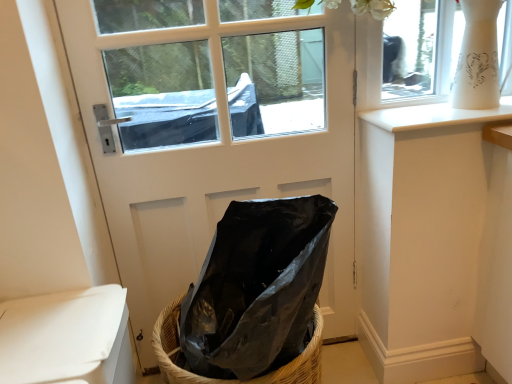
Locate an element on the screen. This screenshot has height=384, width=512. woven straw basket at lower center is located at coordinates (232, 379).

What is the approximate width of white matte toilet at lower left?

white matte toilet at lower left is 14.85 inches wide.

Locate an element on the screen. This screenshot has height=384, width=512. white matte door at center is located at coordinates (213, 131).

This screenshot has height=384, width=512. I want to click on black plastic bag at center, so click(x=256, y=288).

Identify the location of white glossy window sill at upper right. (434, 116).

Is black plastic bag at center completely or partially outside of white matte door at center?

Indeed, black plastic bag at center is completely outside white matte door at center.

Is black plastic bag at center wider than white matte door at center?

Indeed, black plastic bag at center has a greater width compared to white matte door at center.

Is black plastic bag at center not close to white matte door at center?

No, there isn't a large distance between black plastic bag at center and white matte door at center.

Considering the points (234, 256) and (341, 10), which point is in front, point (234, 256) or point (341, 10)?

Positioned in front is point (234, 256).

What's the angular difference between white matte toilet at lower left and white matte door at center's facing directions?

white matte toilet at lower left and white matte door at center are facing 90.5 degrees away from each other.

Between white matte toilet at lower left and white matte door at center, which one has smaller size?

white matte toilet at lower left is smaller.

Does white matte toilet at lower left touch white matte door at center?

There is a gap between white matte toilet at lower left and white matte door at center.

I want to click on door above the white matte toilet at lower left (from the image's perspective), so click(x=213, y=131).

Which object is further away from the camera taking this photo, white matte door at center or black plastic bag at center?

white matte door at center is behind.

Is white matte door at center not close to black plastic bag at center?

No, there isn't a large distance between white matte door at center and black plastic bag at center.

Which is more to the left, white matte door at center or black plastic bag at center?

white matte door at center.

How different are the orientations of white matte door at center and black plastic bag at center in degrees?

The angular difference between white matte door at center and black plastic bag at center is 0.452 degrees.

Considering the relative sizes of white glossy window sill at upper right and black plastic bag at center in the image provided, is white glossy window sill at upper right smaller than black plastic bag at center?

Indeed, white glossy window sill at upper right has a smaller size compared to black plastic bag at center.

Is white glossy window sill at upper right not close to black plastic bag at center?

white glossy window sill at upper right is actually quite close to black plastic bag at center.

The height and width of the screenshot is (384, 512). In order to click on bag below the white glossy window sill at upper right (from a real-world perspective) in this screenshot , I will do `click(256, 288)`.

Measure the distance from white glossy window sill at upper right to black plastic bag at center.

They are 21.90 inches apart.

How different are the orientations of white glossy window sill at upper right and woven straw basket at lower center in degrees?

They differ by 0.452 degrees in their facing directions.

Would you say woven straw basket at lower center is part of white glossy window sill at upper right's contents?

No, white glossy window sill at upper right does not contain woven straw basket at lower center.

From the image's perspective, which is below, white glossy window sill at upper right or woven straw basket at lower center?

woven straw basket at lower center appears lower in the image.

Where is `window sill above the woven straw basket at lower center (from the image's perspective)`? This screenshot has width=512, height=384. window sill above the woven straw basket at lower center (from the image's perspective) is located at coordinates (434, 116).

Looking at this image, is black plastic bag at center not inside woven straw basket at lower center?

Yes, black plastic bag at center is outside of woven straw basket at lower center.

In the scene shown: How many degrees apart are the facing directions of black plastic bag at center and woven straw basket at lower center?

4.77e-05 degrees.

Considering the relative sizes of black plastic bag at center and woven straw basket at lower center in the image provided, is black plastic bag at center thinner than woven straw basket at lower center?

Indeed, black plastic bag at center has a lesser width compared to woven straw basket at lower center.

Is black plastic bag at center aimed at woven straw basket at lower center?

No, black plastic bag at center is not turned towards woven straw basket at lower center.

Would you say white glossy window sill at upper right is outside white matte door at center?

Absolutely, white glossy window sill at upper right is external to white matte door at center.

Can you confirm if white glossy window sill at upper right is smaller than white matte door at center?

Yes.

Are white glossy window sill at upper right and white matte door at center far apart?

No, white glossy window sill at upper right is in close proximity to white matte door at center.

Which object is further away from the camera taking this photo, white glossy window sill at upper right or white matte door at center?

white glossy window sill at upper right is further away from the camera.

Where is `bag that appears in front of the white matte door at center`? bag that appears in front of the white matte door at center is located at coordinates (256, 288).

Locate an element on the screen. door above the white matte toilet at lower left (from a real-world perspective) is located at coordinates (213, 131).

Consider the image. Which object lies further to the anchor point white glossy window sill at upper right, white matte door at center or white matte toilet at lower left?

white matte toilet at lower left lies further to white glossy window sill at upper right than the other object.

Based on their spatial positions, is woven straw basket at lower center or white matte toilet at lower left closer to black plastic bag at center?

The object closer to black plastic bag at center is woven straw basket at lower center.

When comparing their distances from black plastic bag at center, does white matte toilet at lower left or woven straw basket at lower center seem further?

white matte toilet at lower left is positioned further to the anchor black plastic bag at center.

Estimate the real-world distances between objects in this image. Which object is further from white glossy window sill at upper right, white matte door at center or black plastic bag at center?

black plastic bag at center.

Which object lies nearer to the anchor point white glossy window sill at upper right, woven straw basket at lower center or white matte door at center?

The object closer to white glossy window sill at upper right is white matte door at center.

Looking at the image, which one is located further to white matte toilet at lower left, black plastic bag at center or white glossy window sill at upper right?

Among the two, white glossy window sill at upper right is located further to white matte toilet at lower left.

When comparing their distances from white matte door at center, does woven straw basket at lower center or white glossy window sill at upper right seem closer?

white glossy window sill at upper right is closer to white matte door at center.

When comparing their distances from white glossy window sill at upper right, does white matte toilet at lower left or woven straw basket at lower center seem closer?

woven straw basket at lower center lies closer to white glossy window sill at upper right than the other object.

Image resolution: width=512 pixels, height=384 pixels. Find the location of `bag between white matte door at center and woven straw basket at lower center from top to bottom`. bag between white matte door at center and woven straw basket at lower center from top to bottom is located at coordinates (256, 288).

At what (x,y) coordinates should I click in order to perform the action: click on door between white glossy window sill at upper right and woven straw basket at lower center from top to bottom. Please return your answer as a coordinate pair (x, y). The width and height of the screenshot is (512, 384). Looking at the image, I should click on [213, 131].

Where is `door between white matte toilet at lower left and black plastic bag at center in the horizontal direction`? The image size is (512, 384). door between white matte toilet at lower left and black plastic bag at center in the horizontal direction is located at coordinates (213, 131).

This screenshot has width=512, height=384. What are the coordinates of `basket between white matte toilet at lower left and black plastic bag at center in the horizontal direction` in the screenshot? It's located at (232, 379).